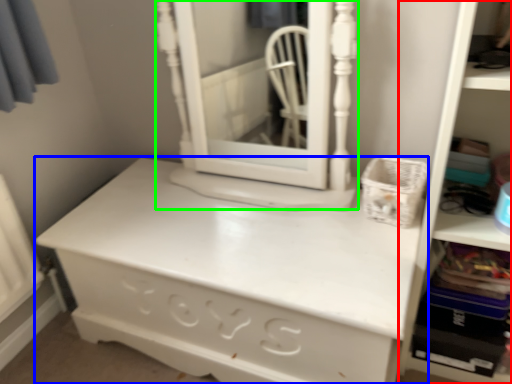
Question: Which object is the closest to the bookshelf (highlighted by a red box)? Choose among these: chest of drawers (highlighted by a blue box) or medicine cabinet (highlighted by a green box).

Choices:
 (A) chest of drawers
 (B) medicine cabinet

Answer: (A)